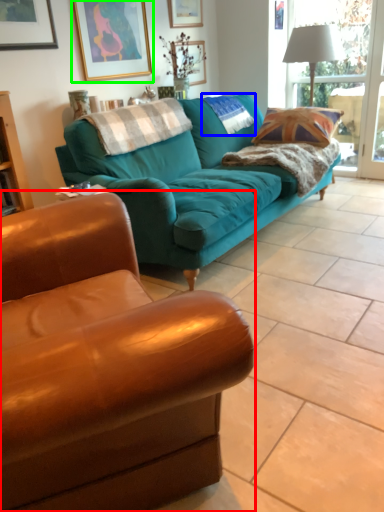
Question: Which object is the farthest from studio couch (highlighted by a red box)? Choose among these: pillow (highlighted by a blue box) or picture frame (highlighted by a green box).

Choices:
 (A) pillow
 (B) picture frame

Answer: (A)